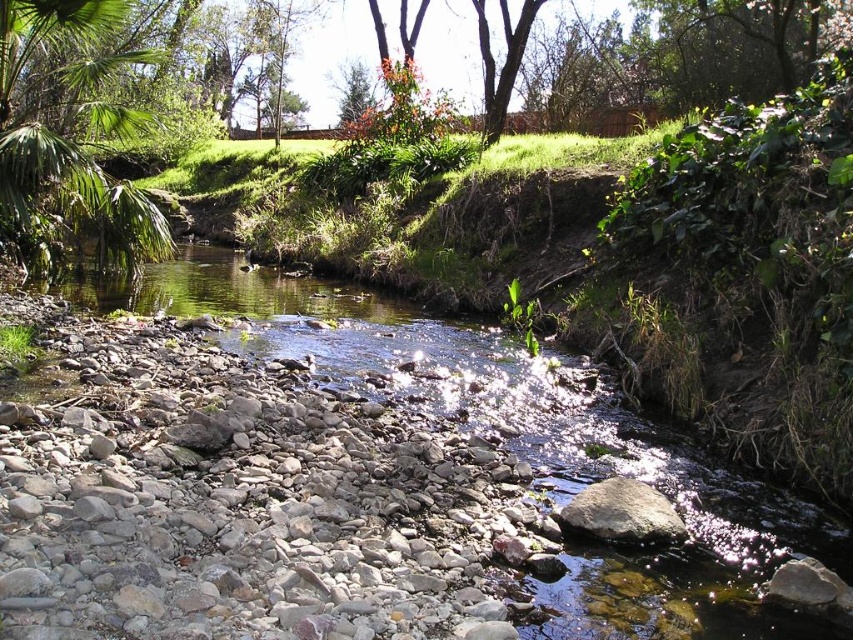
Question: Does green leafy palm at left appear under brown rough tree at upper center?

Choices:
 (A) yes
 (B) no

Answer: (A)

Question: Which point is closer to the camera taking this photo?

Choices:
 (A) (421, 8)
 (B) (117, 372)
 (C) (473, 1)
 (D) (71, 204)

Answer: (B)

Question: Which object is the closest to the brown rough tree at upper center?

Choices:
 (A) orange leafy tree at upper center
 (B) gray/rough rocks at center

Answer: (A)

Question: Among these points, which one is nearest to the camera?

Choices:
 (A) (531, 10)
 (B) (410, 68)
 (C) (15, 198)
 (D) (491, 628)

Answer: (D)

Question: From the image, what is the correct spatial relationship of gray/rough rocks at center in relation to brown rough tree at upper center?

Choices:
 (A) left
 (B) right

Answer: (A)

Question: Does green leafy palm at left have a larger size compared to brown rough tree at upper center?

Choices:
 (A) yes
 (B) no

Answer: (A)